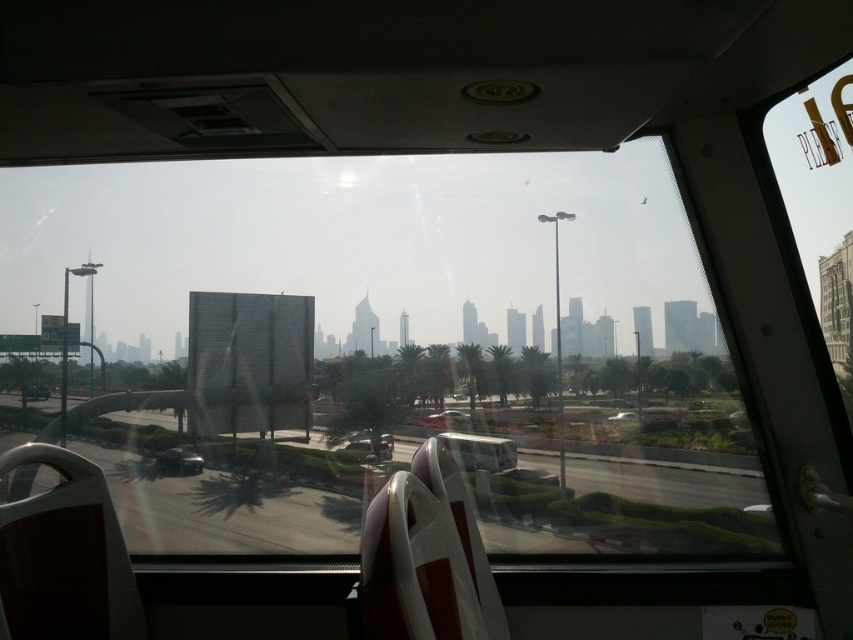
Is transparent glass train window at center taller than metallic silver bus at center?

Correct, transparent glass train window at center is much taller as metallic silver bus at center.

Does transparent glass train window at center have a greater width compared to metallic silver bus at center?

Yes.

The height and width of the screenshot is (640, 853). I want to click on transparent glass train window at center, so click(381, 346).